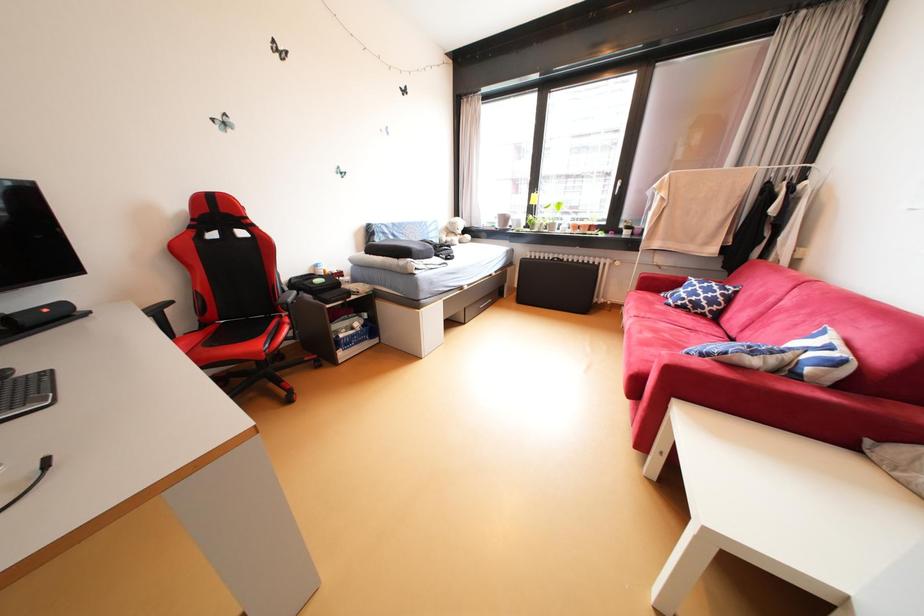
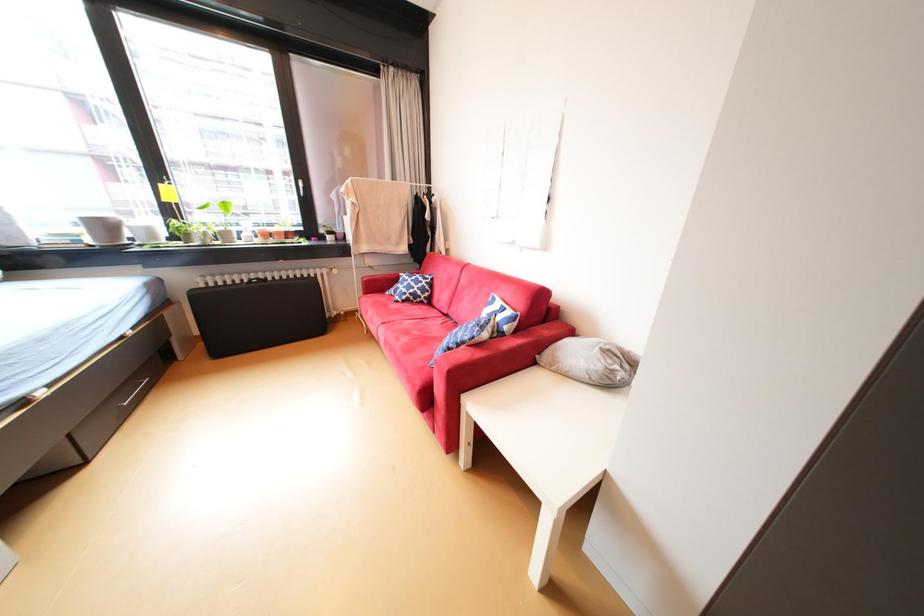
Question: Based on the continuous images, in which direction is the camera rotating? Reply with the corresponding letter.

Choices:
 (A) Left
 (B) Right
 (C) Up
 (D) Down

Answer: (B)